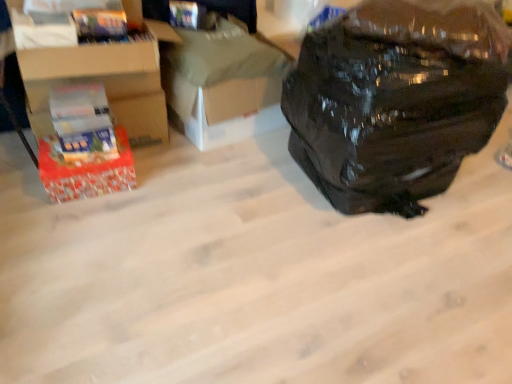
Question: Is white cardboard box at center, marked as the second cardboard box in a left-to-right arrangement, turned away from red cardboard box at left?

Choices:
 (A) yes
 (B) no

Answer: (B)

Question: Is the depth of white cardboard box at center, marked as the second cardboard box in a left-to-right arrangement, less than that of red cardboard box at left?

Choices:
 (A) yes
 (B) no

Answer: (B)

Question: Is red cardboard box at left completely or partially inside white cardboard box at center, which is the first cardboard box in right-to-left order?

Choices:
 (A) no
 (B) yes

Answer: (A)

Question: Is white cardboard box at center, marked as the second cardboard box in a left-to-right arrangement, shorter than red cardboard box at left?

Choices:
 (A) yes
 (B) no

Answer: (B)

Question: Does white cardboard box at center, marked as the second cardboard box in a left-to-right arrangement, have a greater height compared to red cardboard box at left?

Choices:
 (A) yes
 (B) no

Answer: (A)

Question: Does point (147, 39) appear closer or farther from the camera than point (228, 62)?

Choices:
 (A) farther
 (B) closer

Answer: (B)

Question: Based on their sizes in the image, would you say cardboard box at left, the first cardboard box in the left-to-right sequence, is bigger or smaller than white cardboard box at center, marked as the second cardboard box in a left-to-right arrangement?

Choices:
 (A) big
 (B) small

Answer: (A)

Question: Visually, is cardboard box at left, the first cardboard box in the left-to-right sequence, positioned to the left or to the right of white cardboard box at center, marked as the second cardboard box in a left-to-right arrangement?

Choices:
 (A) left
 (B) right

Answer: (A)

Question: Considering the positions of cardboard box at left, the first cardboard box in the left-to-right sequence, and white cardboard box at center, marked as the second cardboard box in a left-to-right arrangement, in the image, is cardboard box at left, the first cardboard box in the left-to-right sequence, wider or thinner than white cardboard box at center, marked as the second cardboard box in a left-to-right arrangement,?

Choices:
 (A) wide
 (B) thin

Answer: (B)

Question: From a real-world perspective, is red cardboard box at left positioned above or below black matte backpack at right?

Choices:
 (A) above
 (B) below

Answer: (B)

Question: In terms of height, does red cardboard box at left look taller or shorter compared to black matte backpack at right?

Choices:
 (A) tall
 (B) short

Answer: (B)

Question: Looking at their shapes, would you say red cardboard box at left is wider or thinner than black matte backpack at right?

Choices:
 (A) thin
 (B) wide

Answer: (A)

Question: Would you say red cardboard box at left is to the left or to the right of black matte backpack at right in the picture?

Choices:
 (A) left
 (B) right

Answer: (A)

Question: Is white cardboard box at center, which is the first cardboard box in right-to-left order, in front of or behind red cardboard box at left in the image?

Choices:
 (A) front
 (B) behind

Answer: (B)

Question: From a real-world perspective, is white cardboard box at center, which is the first cardboard box in right-to-left order, physically located above or below red cardboard box at left?

Choices:
 (A) below
 (B) above

Answer: (B)